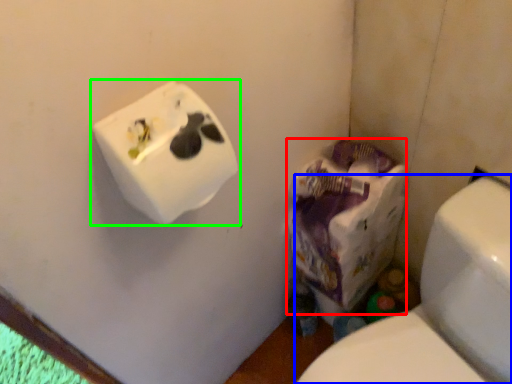
Question: Based on their relative distances, which object is nearer to paper bag (highlighted by a red box)? Choose from toilet (highlighted by a blue box) and toilet paper (highlighted by a green box).

Choices:
 (A) toilet
 (B) toilet paper

Answer: (A)